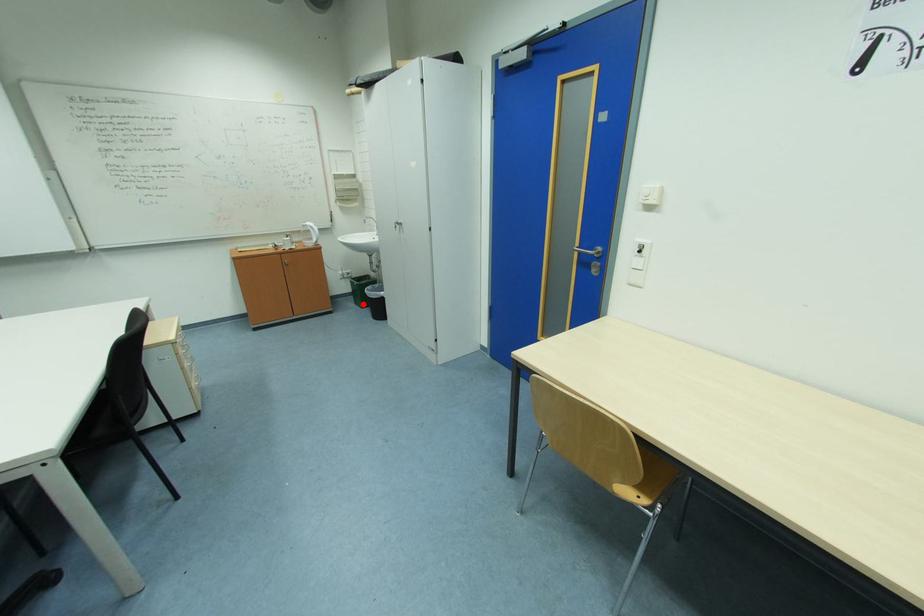
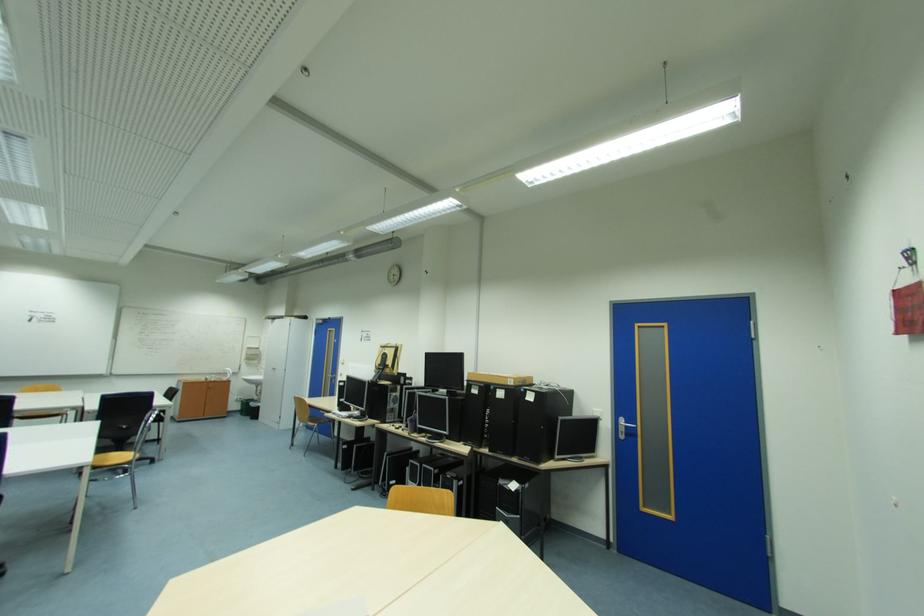
Find the pixel in the second image that matches the highlighted location in the first image.

(249, 416)